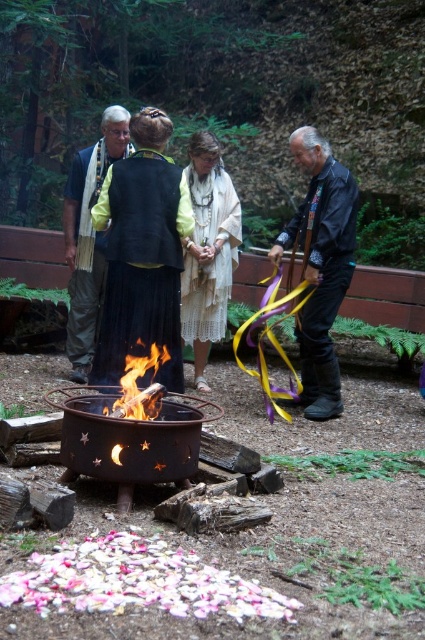
Does point (312, 330) come closer to viewer compared to point (218, 220)?

Yes.

Which is behind, point (322, 365) or point (226, 253)?

The point (226, 253) is more distant.

Locate an element on the screen. The image size is (425, 640). black leather jacket at right is located at coordinates (320, 266).

The height and width of the screenshot is (640, 425). What do you see at coordinates (142, 253) in the screenshot?
I see `black velvet vest at center` at bounding box center [142, 253].

Which is behind, point (119, 304) or point (340, 288)?

The point (340, 288) is more distant.

Where is `black velvet vest at center`? Image resolution: width=425 pixels, height=640 pixels. black velvet vest at center is located at coordinates (142, 253).

Between black velvet vest at center and flamewood at center, which one is positioned higher?

black velvet vest at center

This screenshot has width=425, height=640. Describe the element at coordinates (142, 253) in the screenshot. I see `black velvet vest at center` at that location.

Between point (127, 284) and point (149, 396), which one is positioned in front?

Point (149, 396) is more forward.

Where is `black velvet vest at center`? Image resolution: width=425 pixels, height=640 pixels. black velvet vest at center is located at coordinates (142, 253).